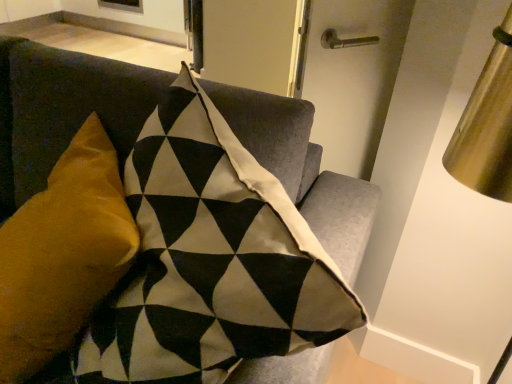
What do you see at coordinates (63, 254) in the screenshot?
I see `velvet mustard pillow at left` at bounding box center [63, 254].

What is the approximate width of velvet mustard pillow at left?

The width of velvet mustard pillow at left is 14.56 inches.

This screenshot has width=512, height=384. Find the location of `velvet mustard pillow at left`. velvet mustard pillow at left is located at coordinates (63, 254).

The width and height of the screenshot is (512, 384). What do you see at coordinates (64, 110) in the screenshot? I see `velvet cushion at upper left` at bounding box center [64, 110].

The height and width of the screenshot is (384, 512). I want to click on velvet cushion at upper left, so click(64, 110).

You are a GUI agent. You are given a task and a screenshot of the screen. Output one action in this format:
    pyautogui.click(x=<x>, y=<y>)
    Task: Click on the velvet mustard pillow at left
    The image size is (512, 384).
    Given the screenshot: What is the action you would take?
    pyautogui.click(x=63, y=254)

Does velvet mustard pillow at left appear on the left side of velvet cushion at upper left?

No.

Relative to velvet cushion at upper left, is velvet mustard pillow at left in front or behind?

Visually, velvet mustard pillow at left is located behind velvet cushion at upper left.

Is point (111, 232) closer to camera compared to point (263, 361)?

No, (111, 232) is further to viewer.

From the image's perspective, between velvet mustard pillow at left and velvet cushion at upper left, who is located below?

velvet cushion at upper left.

From a real-world perspective, is velvet mustard pillow at left over velvet cushion at upper left?

Yes, from a real-world perspective, velvet mustard pillow at left is on top of velvet cushion at upper left.

From the picture: Does velvet mustard pillow at left have a greater width compared to velvet cushion at upper left?

No.

Does velvet mustard pillow at left have a greater height compared to velvet cushion at upper left?

No.

Is velvet mustard pillow at left smaller than velvet cushion at upper left?

Indeed, velvet mustard pillow at left has a smaller size compared to velvet cushion at upper left.

Is velvet mustard pillow at left not within velvet cushion at upper left?

No.

Is velvet mustard pillow at left far away from velvet cushion at upper left?

No, velvet mustard pillow at left is not far away from velvet cushion at upper left.

Is velvet mustard pillow at left facing towards velvet cushion at upper left?

Yes, velvet mustard pillow at left is oriented towards velvet cushion at upper left.

Identify the location of furniture below the velvet mustard pillow at left (from a real-world perspective). (64, 110).

Considering the positions of objects velvet cushion at upper left and velvet mustard pillow at left in the image provided, who is more to the left, velvet cushion at upper left or velvet mustard pillow at left?

velvet cushion at upper left.

Between velvet cushion at upper left and velvet mustard pillow at left, which one is positioned behind?

Positioned behind is velvet mustard pillow at left.

Is point (262, 119) closer to viewer compared to point (80, 261)?

That is False.

From the image's perspective, would you say velvet cushion at upper left is positioned over velvet mustard pillow at left?

No, from the image's perspective, velvet cushion at upper left is not on top of velvet mustard pillow at left.

From a real-world perspective, which object stands above the other?

From a 3D spatial view, velvet mustard pillow at left is above.

Which object is thinner, velvet cushion at upper left or velvet mustard pillow at left?

velvet mustard pillow at left is thinner.

Which of these two, velvet cushion at upper left or velvet mustard pillow at left, stands shorter?

velvet mustard pillow at left is shorter.

Is velvet cushion at upper left bigger or smaller than velvet mustard pillow at left?

Considering their sizes, velvet cushion at upper left takes up more space than velvet mustard pillow at left.

Would you say velvet mustard pillow at left is part of velvet cushion at upper left's contents?

Indeed, velvet mustard pillow at left is located within velvet cushion at upper left.

Are velvet cushion at upper left and velvet mustard pillow at left far apart?

No.

Is velvet cushion at upper left oriented away from velvet mustard pillow at left?

Yes, velvet mustard pillow at left is at the back of velvet cushion at upper left.

At what (x,y) coordinates should I click in order to perform the action: click on furniture directly beneath the velvet mustard pillow at left (from a real-world perspective). Please return your answer as a coordinate pair (x, y). The width and height of the screenshot is (512, 384). Looking at the image, I should click on coord(64,110).

Find the location of a particular element. pillow on the right of velvet cushion at upper left is located at coordinates (63, 254).

Where is `pillow behind the velvet cushion at upper left`? pillow behind the velvet cushion at upper left is located at coordinates (63, 254).